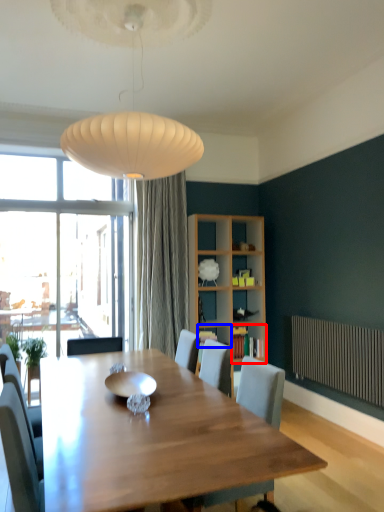
Question: Which object appears closest to the camera in this image, shelf (highlighted by a red box) or shelf (highlighted by a blue box)?

Choices:
 (A) shelf
 (B) shelf

Answer: (B)